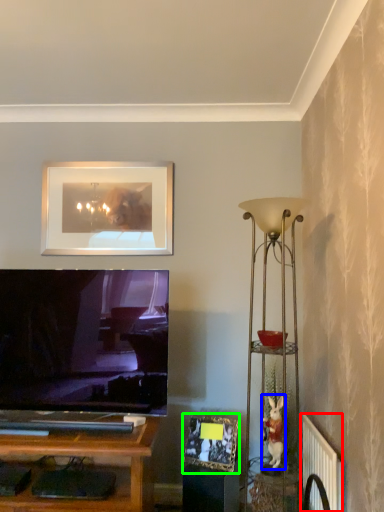
Question: Which object is the closest to the radiator (highlighted by a red box)? Choose among these: toy (highlighted by a blue box) or picture frame (highlighted by a green box).

Choices:
 (A) toy
 (B) picture frame

Answer: (A)